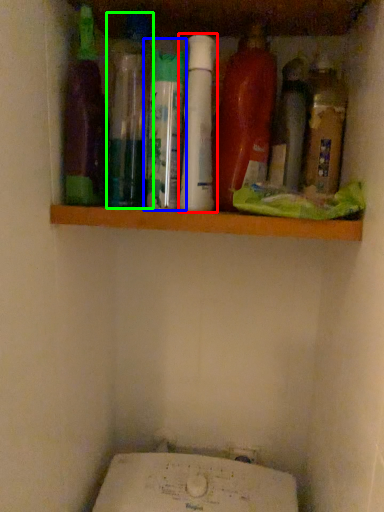
Question: Estimate the real-world distances between objects in this image. Which object is farther from bottle (highlighted by a red box), bottle (highlighted by a blue box) or bottle (highlighted by a green box)?

Choices:
 (A) bottle
 (B) bottle

Answer: (B)